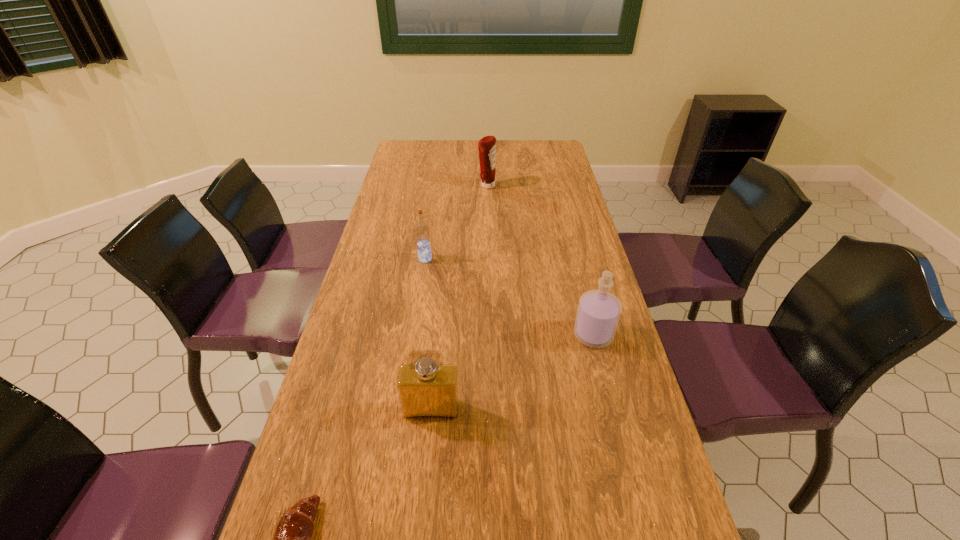
The image size is (960, 540). I want to click on vacant point located 0.170m on the front-facing side of the shorter perfume, so pyautogui.click(x=422, y=499).

Where is `object that is at the right edge`? object that is at the right edge is located at coordinates (598, 313).

At what (x,y) coordinates should I click in order to perform the action: click on vacant space at the far edge of the desktop. Please return your answer as a coordinate pair (x, y). Looking at the image, I should click on click(x=453, y=147).

The image size is (960, 540). I want to click on free space at the left edge of the desktop, so click(x=396, y=296).

Identify the location of vacant space at the right edge. (575, 267).

I want to click on vacant space at the far left corner of the desktop, so click(x=430, y=163).

Locate an element on the screen. The height and width of the screenshot is (540, 960). free point between the second farthest object and the farthest object is located at coordinates (456, 222).

Locate an element on the screen. This screenshot has height=540, width=960. vacant space that is in between the third nearest object and the shorter perfume is located at coordinates (513, 372).

Find the location of a particular element. The height and width of the screenshot is (540, 960). vacant space that's between the nearer perfume and the vodka is located at coordinates (428, 334).

Find the location of a particular element. The height and width of the screenshot is (540, 960). empty space that is in between the third nearest object and the vodka is located at coordinates (509, 297).